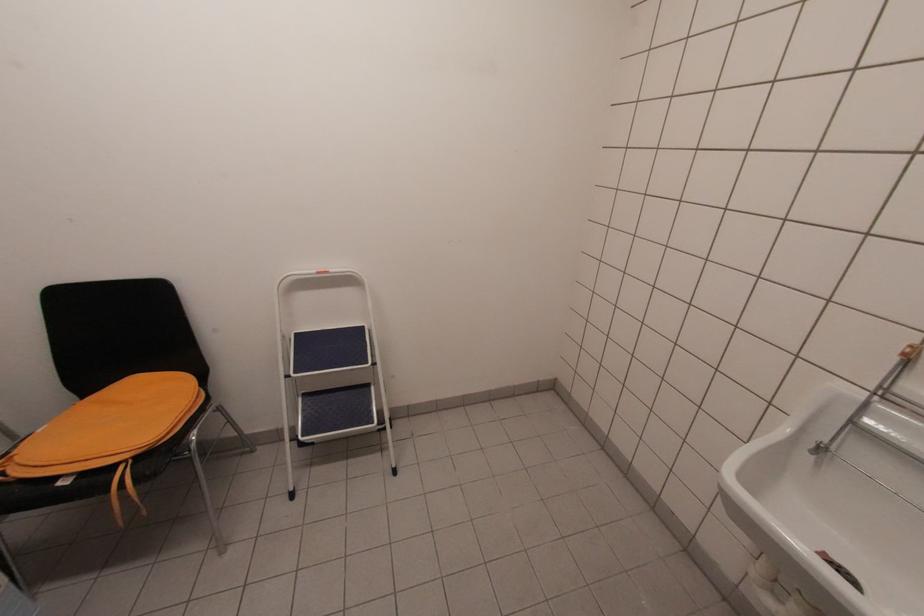
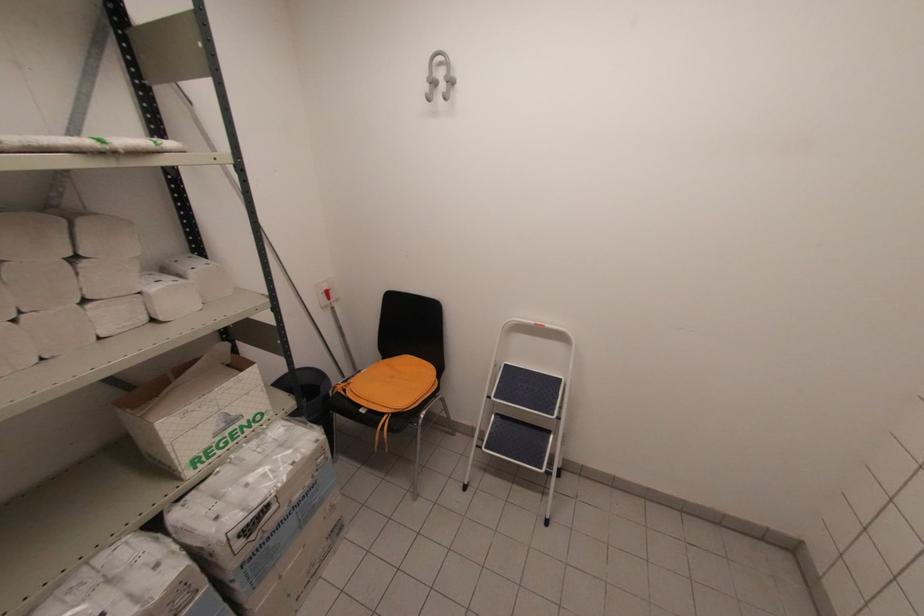
Question: Based on the continuous images, in which direction is the camera rotating? Reply with the corresponding letter.

Choices:
 (A) Left
 (B) Right
 (C) Up
 (D) Down

Answer: (A)